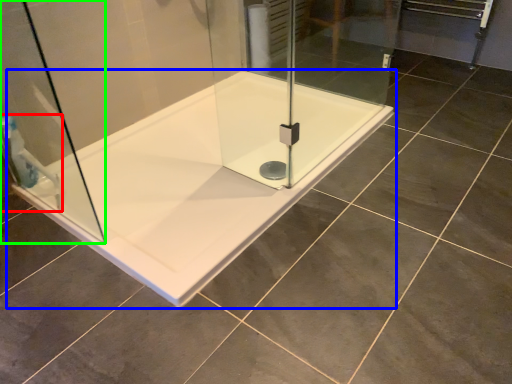
Question: Which object is positioned closest to shower (highlighted by a red box)? Select from bathtub (highlighted by a blue box) and shower door (highlighted by a green box).

Choices:
 (A) bathtub
 (B) shower door

Answer: (B)